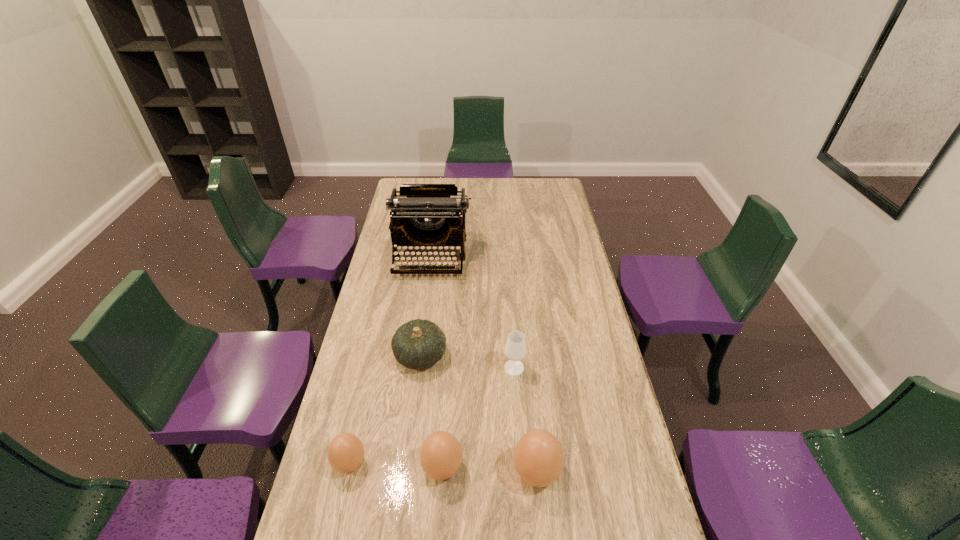
Where is `free spot between the rightmost boiled egg and the glass`? The image size is (960, 540). free spot between the rightmost boiled egg and the glass is located at coordinates click(x=525, y=420).

Where is `vacant point located between the second boiled egg from left to right and the rightmost boiled egg`? vacant point located between the second boiled egg from left to right and the rightmost boiled egg is located at coordinates (490, 470).

I want to click on blank region between the gourd and the farthest object, so click(x=425, y=306).

Locate an element on the screen. The image size is (960, 540). free space between the glass and the shortest boiled egg is located at coordinates (432, 415).

This screenshot has height=540, width=960. What are the coordinates of `free space between the typewriter and the glass` in the screenshot? It's located at (472, 312).

Find the location of a particular element. Image resolution: width=960 pixels, height=540 pixels. vacant area that lies between the shortest object and the gourd is located at coordinates click(x=385, y=409).

You are a GUI agent. You are given a task and a screenshot of the screen. Output one action in this format:
    pyautogui.click(x=<x>, y=<y>)
    Task: Click on the empty location between the shortest object and the tallest object
    The width and height of the screenshot is (960, 540).
    Given the screenshot: What is the action you would take?
    pyautogui.click(x=390, y=360)

Find the location of a particular element. The image size is (960, 540). vacant area that lies between the gourd and the second boiled egg from right to left is located at coordinates (431, 411).

Where is `object that is the third closest to the leftmost boiled egg`? This screenshot has height=540, width=960. object that is the third closest to the leftmost boiled egg is located at coordinates (538, 457).

Identify which object is the closest to the second tallest boiled egg. Please provide its 2D coordinates. Your answer should be formatted as a tuple, i.e. [(x, y)], where the tuple contains the x and y coordinates of a point satisfying the conditions above.

[(538, 457)]